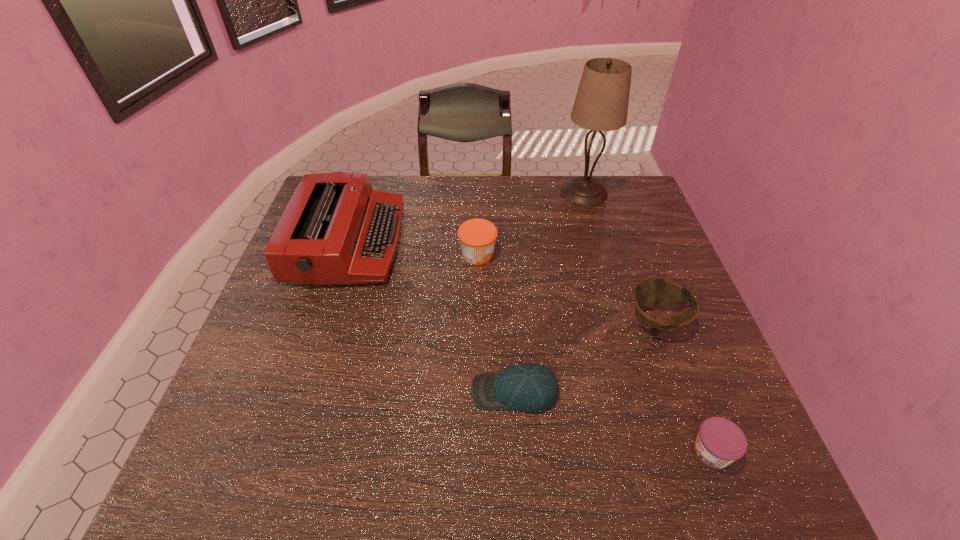
The width and height of the screenshot is (960, 540). What are the coordinates of `object that is at the left edge` in the screenshot? It's located at (336, 229).

Find the location of a particular element. The image size is (960, 540). lampshade located at the right edge is located at coordinates (601, 104).

Where is `bowl positioned at the right edge`? The height and width of the screenshot is (540, 960). bowl positioned at the right edge is located at coordinates (650, 292).

The width and height of the screenshot is (960, 540). I want to click on jam at the right edge, so click(x=719, y=442).

I want to click on object situated at the far left corner, so click(336, 229).

At what (x,y) coordinates should I click in order to perform the action: click on object positioned at the far right corner. Please return your answer as a coordinate pair (x, y). Image resolution: width=960 pixels, height=540 pixels. Looking at the image, I should click on (601, 104).

Find the location of a particular element. This screenshot has width=960, height=540. object at the near right corner is located at coordinates (719, 442).

Where is `vacant area at the far edge`? The image size is (960, 540). vacant area at the far edge is located at coordinates (x=460, y=182).

Image resolution: width=960 pixels, height=540 pixels. I want to click on vacant region at the near edge, so click(x=492, y=449).

Where is `blank space at the left edge`? blank space at the left edge is located at coordinates (309, 304).